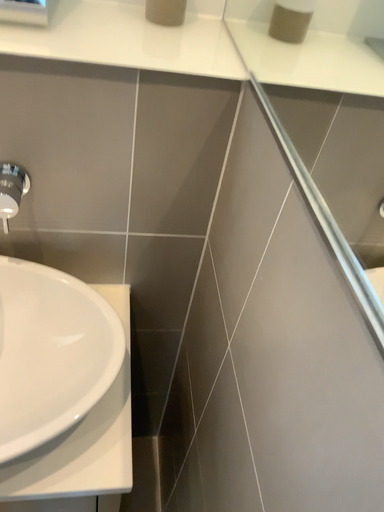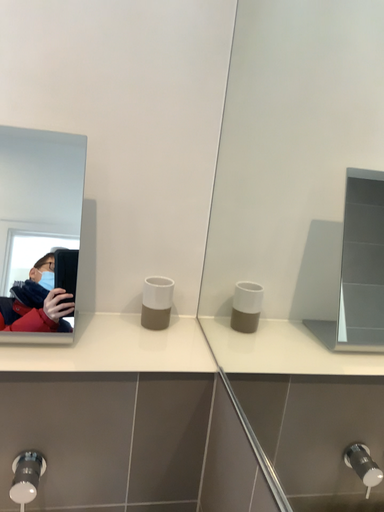
Question: How did the camera likely rotate when shooting the video?

Choices:
 (A) rotated downward
 (B) rotated upward

Answer: (B)